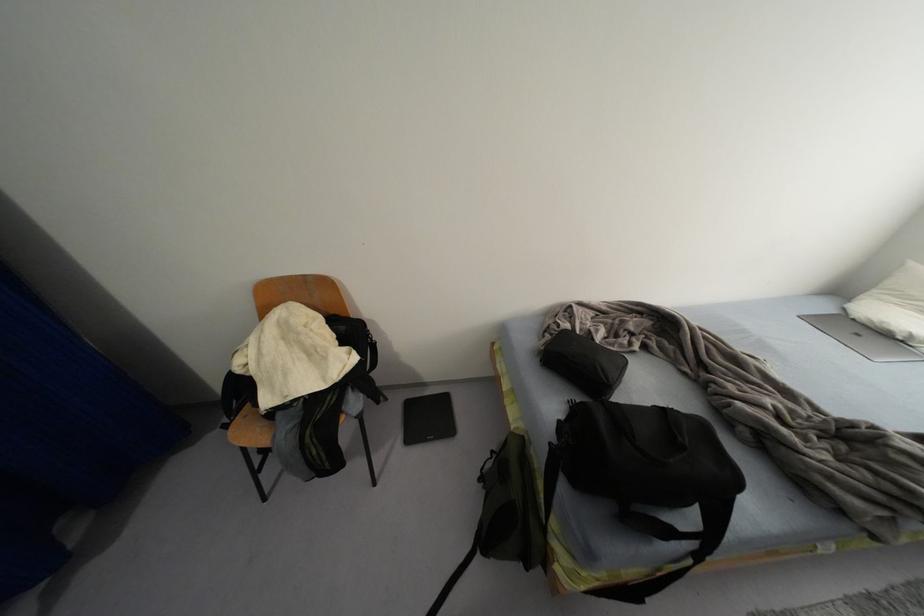
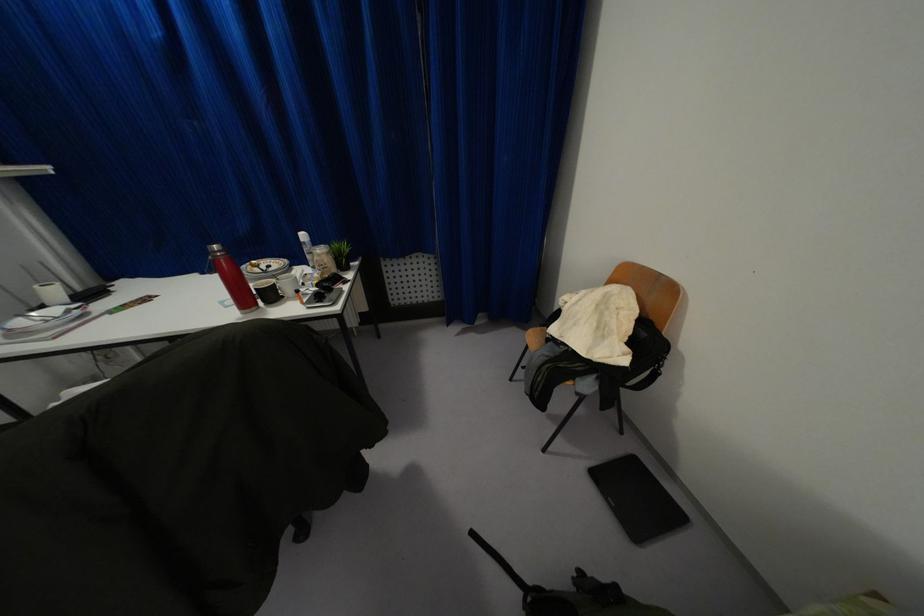
Locate, in the second image, the point that corresponds to point 428,416 in the first image.

(636, 493)